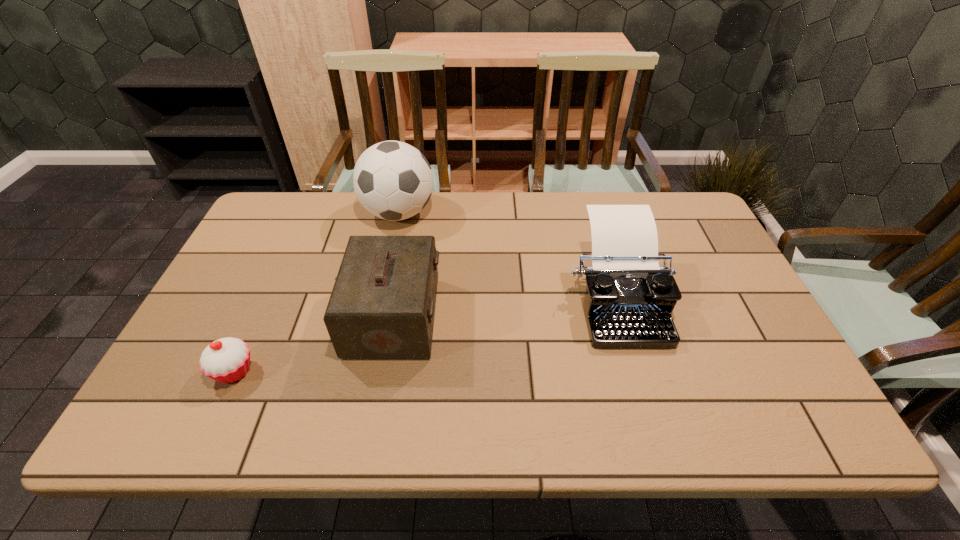
Where is `vacant space that's between the tallest object and the shortest object`? This screenshot has width=960, height=540. vacant space that's between the tallest object and the shortest object is located at coordinates (317, 292).

Locate an element on the screen. The image size is (960, 540). vacant area between the first-aid kit and the shortest object is located at coordinates (314, 344).

Locate an element on the screen. This screenshot has height=540, width=960. free area in between the first-aid kit and the rightmost object is located at coordinates (505, 307).

The height and width of the screenshot is (540, 960). Find the location of `blank region between the typewriter and the first-aid kit`. blank region between the typewriter and the first-aid kit is located at coordinates (505, 307).

The height and width of the screenshot is (540, 960). In order to click on object that ranks as the second closest to the tallest object in this screenshot , I will do `click(628, 304)`.

The image size is (960, 540). Find the location of `object that stands as the second closest to the typewriter`. object that stands as the second closest to the typewriter is located at coordinates (393, 180).

You are a GUI agent. You are given a task and a screenshot of the screen. Output one action in this format:
    pyautogui.click(x=<x>, y=<y>)
    Task: Click on the blank space that satisfies the following two spatial constraints: 1. on the back side of the cupcake; 2. on the right side of the soccer ball
    The width and height of the screenshot is (960, 540).
    Given the screenshot: What is the action you would take?
    pyautogui.click(x=306, y=213)